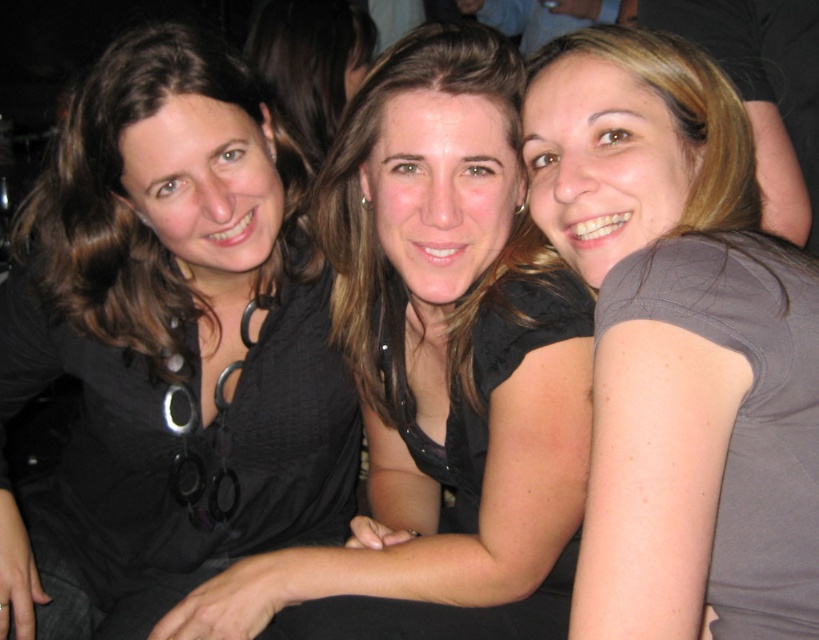
Question: Is black matte/black fabric at left positioned in front of matte gray shirt at right?

Choices:
 (A) yes
 (B) no

Answer: (B)

Question: Which point is closer to the camera?

Choices:
 (A) matte gray shirt at right
 (B) black matte/black fabric at left

Answer: (A)

Question: In this image, where is black matte/black fabric at left located relative to matte gray shirt at right?

Choices:
 (A) below
 (B) above

Answer: (A)

Question: Can you confirm if black matte/black fabric at left is positioned above matte gray shirt at right?

Choices:
 (A) no
 (B) yes

Answer: (A)

Question: Among these points, which one is nearest to the camera?

Choices:
 (A) (720, 451)
 (B) (137, 634)

Answer: (A)